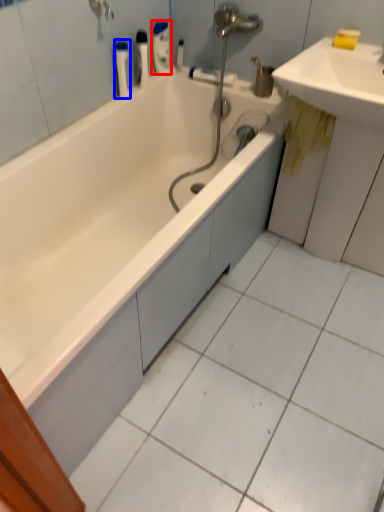
Question: Which object is closer to the camera taking this photo, toiletry (highlighted by a red box) or toiletry (highlighted by a blue box)?

Choices:
 (A) toiletry
 (B) toiletry

Answer: (B)